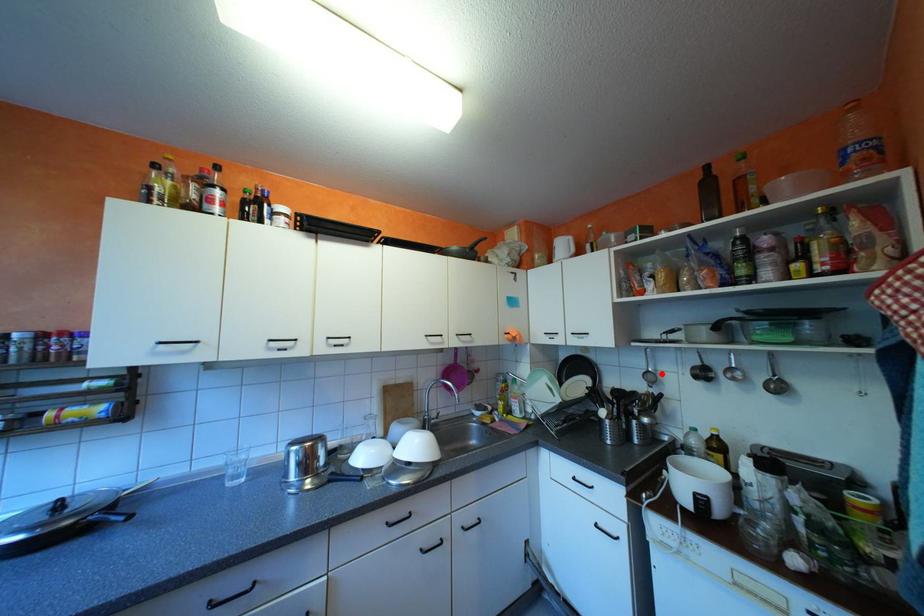
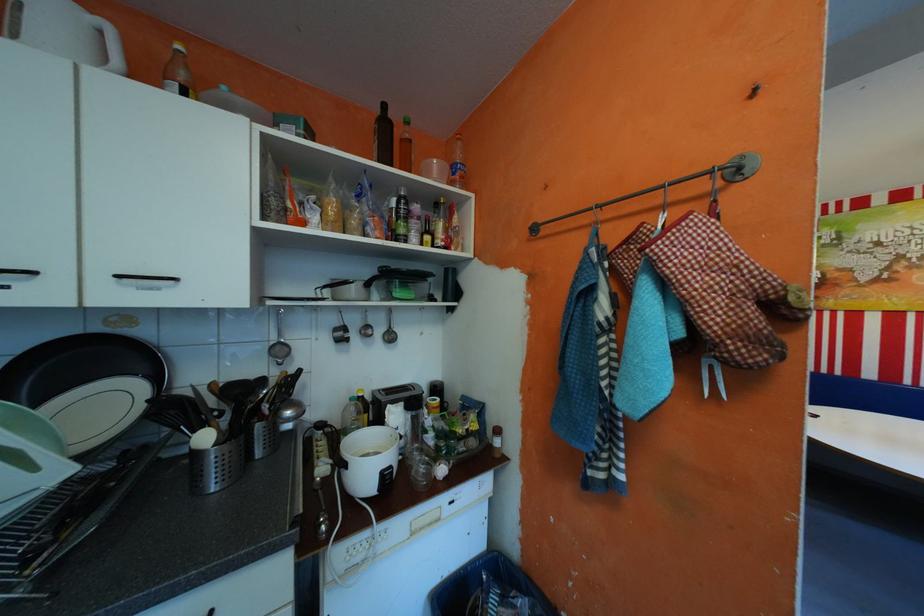
Where in the second image is the point corresponding to the highlighted location from the first image?

(289, 346)